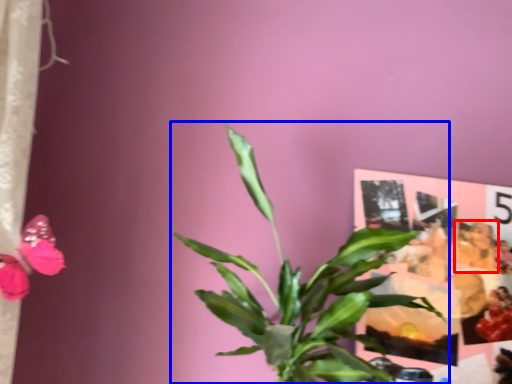
Question: Among these objects, which one is nearest to the camera, person (highlighted by a red box) or houseplant (highlighted by a blue box)?

Choices:
 (A) person
 (B) houseplant

Answer: (B)